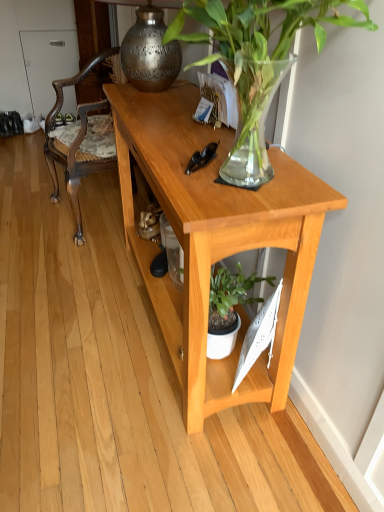
The image size is (384, 512). Describe the element at coordinates (149, 48) in the screenshot. I see `polished brass lamp at upper center` at that location.

Where is `black plastic sunglasses at center`? The height and width of the screenshot is (512, 384). black plastic sunglasses at center is located at coordinates (202, 157).

Describe the element at coordinates (202, 157) in the screenshot. I see `black plastic sunglasses at center` at that location.

Locate an element on the screen. wooden carved chair at left is located at coordinates (82, 137).

Find the location of a particular element. This screenshot has height=512, width=384. green glossy plant at upper center is located at coordinates (257, 62).

Is wooden carved chair at left next to black plastic sunglasses at center?

They are not placed beside each other.

Is wooden carved chair at left taller than black plastic sunglasses at center?

Correct, wooden carved chair at left is much taller as black plastic sunglasses at center.

From the image's perspective, which one is positioned higher, wooden carved chair at left or black plastic sunglasses at center?

wooden carved chair at left appears higher in the image.

In the image, is wooden carved chair at left on the left side or the right side of black plastic sunglasses at center?

wooden carved chair at left is to the left of black plastic sunglasses at center.

Looking at this image, between light wood desk at center and polished brass lamp at upper center, which one has smaller size?

Smaller between the two is polished brass lamp at upper center.

Can you confirm if light wood desk at center is wider than polished brass lamp at upper center?

In fact, light wood desk at center might be narrower than polished brass lamp at upper center.

From the image's perspective, relative to polished brass lamp at upper center, is light wood desk at center above or below?

Based on their image positions, light wood desk at center is located beneath polished brass lamp at upper center.

In the image, is light wood desk at center on the left side or the right side of polished brass lamp at upper center?

In the image, light wood desk at center appears on the right side of polished brass lamp at upper center.

Is polished brass lamp at upper center situated inside wooden carved chair at left or outside?

The correct answer is: outside.

From the image's perspective, which one is positioned higher, polished brass lamp at upper center or wooden carved chair at left?

polished brass lamp at upper center.

What are the coordinates of `lamp above the wooden carved chair at left (from a real-world perspective)` in the screenshot? It's located at (149, 48).

Which object is positioned more to the right, green glossy plant at upper center or wooden carved chair at left?

green glossy plant at upper center.

Which is nearer, (226, 163) or (68, 139)?

Point (226, 163).

Can you tell me how much green glossy plant at upper center and wooden carved chair at left differ in facing direction?

10.9 degrees.

Is green glossy plant at upper center next to wooden carved chair at left?

No, green glossy plant at upper center is not in contact with wooden carved chair at left.

Which object is wider, black plastic sunglasses at center or green glossy plant at upper center?

green glossy plant at upper center.

Does point (213, 156) come closer to viewer compared to point (235, 31)?

No.

From a real-world perspective, relative to polished brass lamp at upper center, is wooden carved chair at left vertically above or below?

wooden carved chair at left is situated lower than polished brass lamp at upper center in the real world.

Considering the sizes of objects wooden carved chair at left and polished brass lamp at upper center in the image provided, who is taller, wooden carved chair at left or polished brass lamp at upper center?

wooden carved chair at left.

Is wooden carved chair at left oriented towards polished brass lamp at upper center?

No, wooden carved chair at left does not turn towards polished brass lamp at upper center.

From the picture: Is wooden carved chair at left not within polished brass lamp at upper center?

That's correct, wooden carved chair at left is outside of polished brass lamp at upper center.

Between point (104, 157) and point (257, 168), which one is positioned behind?

The point (104, 157) is more distant.

Considering the sizes of objects wooden carved chair at left and green glossy plant at upper center in the image provided, who is taller, wooden carved chair at left or green glossy plant at upper center?

With more height is wooden carved chair at left.

Is green glossy plant at upper center located within wooden carved chair at left?

That's incorrect, green glossy plant at upper center is not inside wooden carved chair at left.

Find the location of a particular element. glasses that appears below the wooden carved chair at left (from the image's perspective) is located at coordinates (202, 157).

This screenshot has height=512, width=384. Find the location of `desk located underneath the polished brass lamp at upper center (from a real-world perspective)`. desk located underneath the polished brass lamp at upper center (from a real-world perspective) is located at coordinates (216, 242).

From the picture: Based on their spatial positions, is light wood desk at center or green glossy plant at upper center further from black plastic sunglasses at center?

light wood desk at center lies further to black plastic sunglasses at center than the other object.

Which object lies nearer to the anchor point black plastic sunglasses at center, green glossy plant at upper center or polished brass lamp at upper center?

green glossy plant at upper center lies closer to black plastic sunglasses at center than the other object.

Which object lies nearer to the anchor point wooden carved chair at left, green glossy plant at upper center or light wood desk at center?

light wood desk at center lies closer to wooden carved chair at left than the other object.

Which object lies nearer to the anchor point wooden carved chair at left, black plastic sunglasses at center or polished brass lamp at upper center?

Among the two, polished brass lamp at upper center is located nearer to wooden carved chair at left.

Considering their positions, is light wood desk at center positioned closer to polished brass lamp at upper center than wooden carved chair at left?

light wood desk at center is closer to polished brass lamp at upper center.

Based on their spatial positions, is light wood desk at center or polished brass lamp at upper center closer to black plastic sunglasses at center?

light wood desk at center is closer to black plastic sunglasses at center.

When comparing their distances from polished brass lamp at upper center, does wooden carved chair at left or light wood desk at center seem further?

Among the two, wooden carved chair at left is located further to polished brass lamp at upper center.

Looking at the image, which one is located further to light wood desk at center, polished brass lamp at upper center or black plastic sunglasses at center?

Based on the image, polished brass lamp at upper center appears to be further to light wood desk at center.

At what (x,y) coordinates should I click in order to perform the action: click on desk located between green glossy plant at upper center and wooden carved chair at left in the depth direction. Please return your answer as a coordinate pair (x, y). Looking at the image, I should click on (216, 242).

This screenshot has width=384, height=512. What are the coordinates of `desk between green glossy plant at upper center and polished brass lamp at upper center in the front-back direction` in the screenshot? It's located at (216, 242).

Locate an element on the screen. The width and height of the screenshot is (384, 512). desk located between green glossy plant at upper center and black plastic sunglasses at center in the depth direction is located at coordinates (216, 242).

You are a GUI agent. You are given a task and a screenshot of the screen. Output one action in this format:
    pyautogui.click(x=<x>, y=<y>)
    Task: Click on the glasses located between green glossy plant at upper center and polished brass lamp at upper center in the depth direction
    This screenshot has width=384, height=512.
    Given the screenshot: What is the action you would take?
    [x=202, y=157]